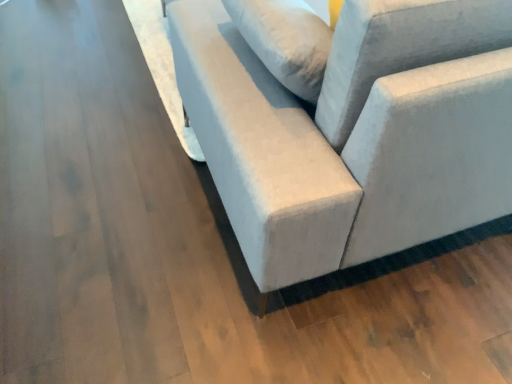
Where is `vacant area to the left of light gray fabric couch at center`? The image size is (512, 384). vacant area to the left of light gray fabric couch at center is located at coordinates (94, 107).